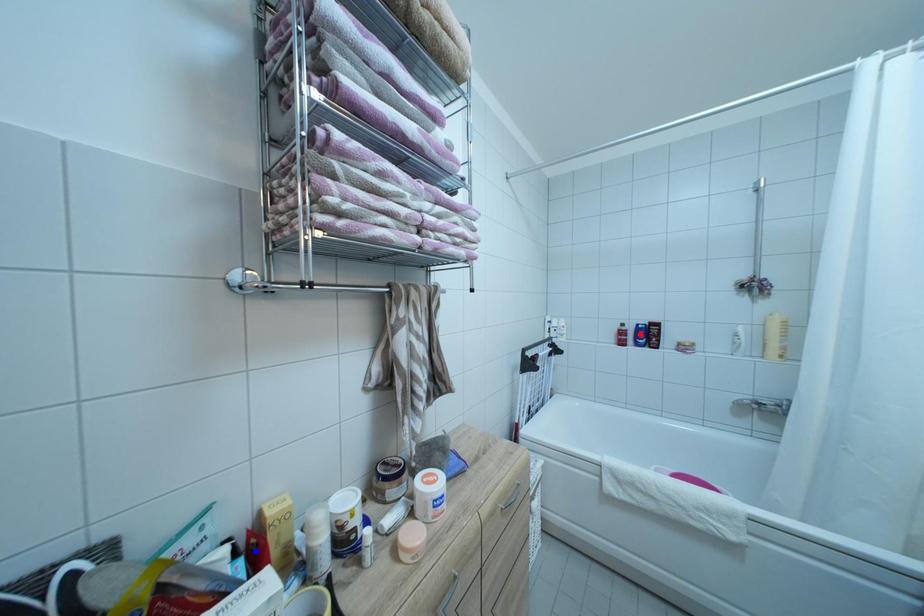
Question: Two points are marked on the image. Which point is closer to the camera?

Choices:
 (A) Blue point is closer.
 (B) Red point is closer.

Answer: (A)